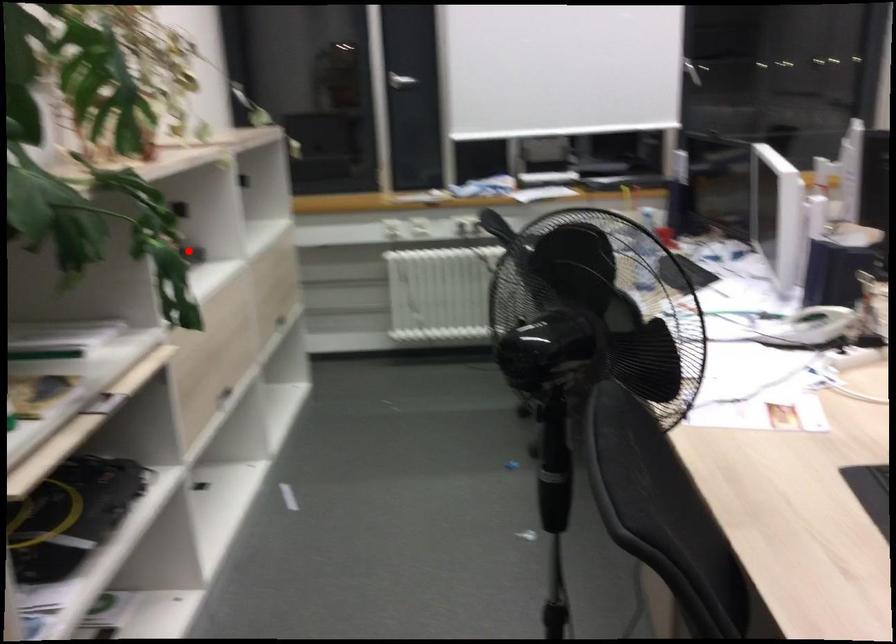
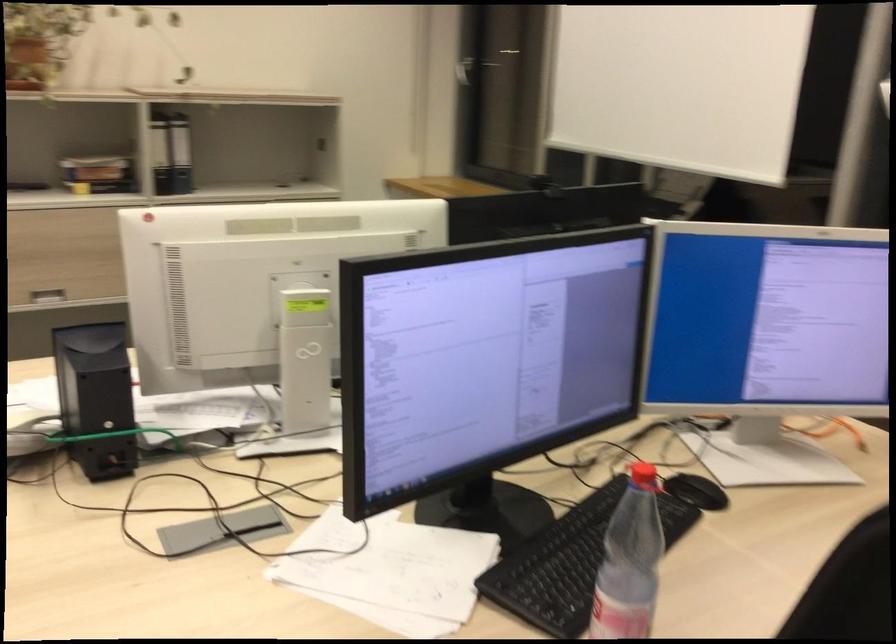
Locate, in the second image, the point that corresponds to the highlighted location in the first image.

(105, 175)